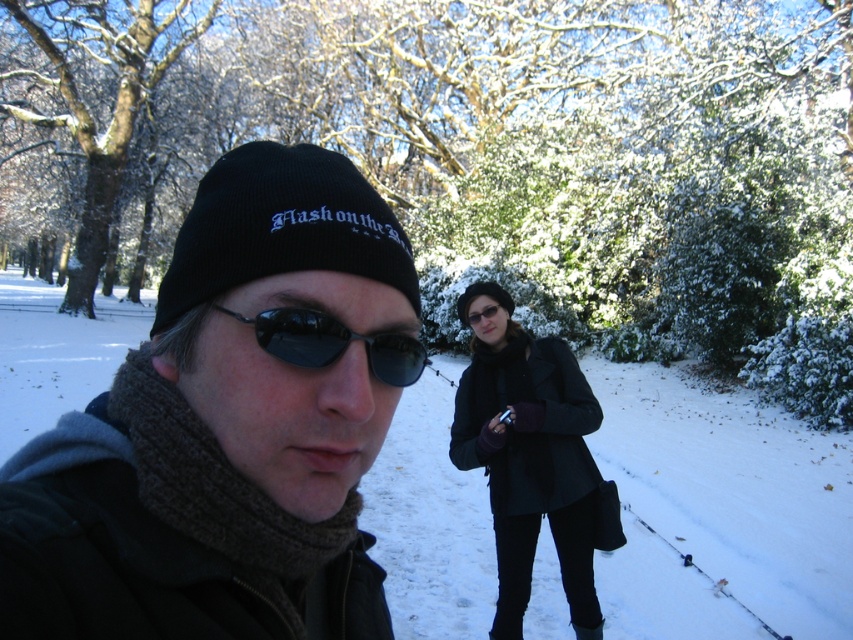
Question: Is black knit cap at center thinner than black matte coat at center?

Choices:
 (A) yes
 (B) no

Answer: (A)

Question: Which of the following is the closest to the observer?

Choices:
 (A) (97, 525)
 (B) (263, 332)

Answer: (B)

Question: Considering the real-world distances, which object is closest to the black reflective sunglasses at center?

Choices:
 (A) black matte coat at center
 (B) black knit cap at center

Answer: (B)

Question: Where is black matte coat at center located in relation to black reflective sunglasses at center in the image?

Choices:
 (A) below
 (B) above

Answer: (A)

Question: Is black knit cap at center in front of black reflective sunglasses at center?

Choices:
 (A) yes
 (B) no

Answer: (A)

Question: Among these points, which one is farthest from the camera?

Choices:
 (A) (271, 342)
 (B) (534, 468)
 (C) (277, 497)

Answer: (B)